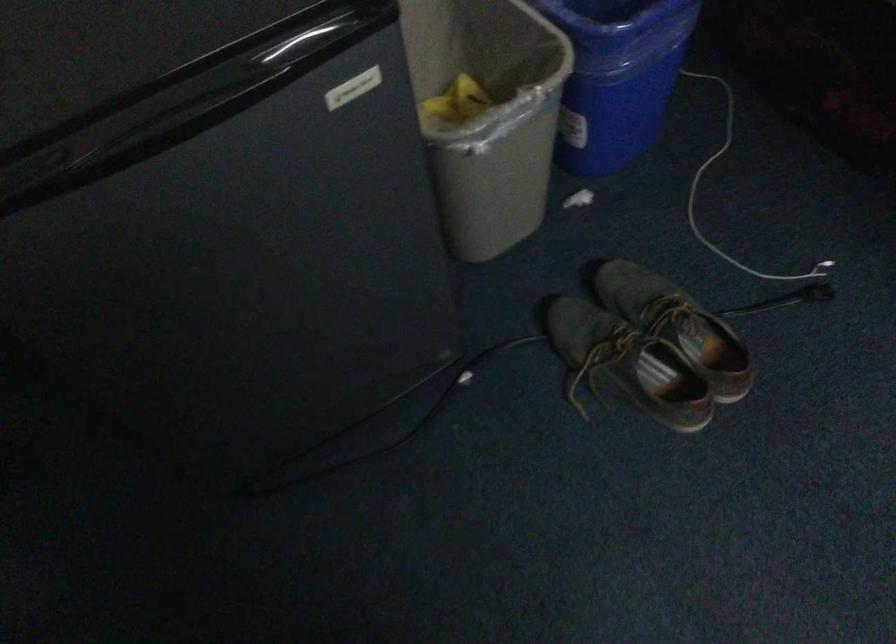
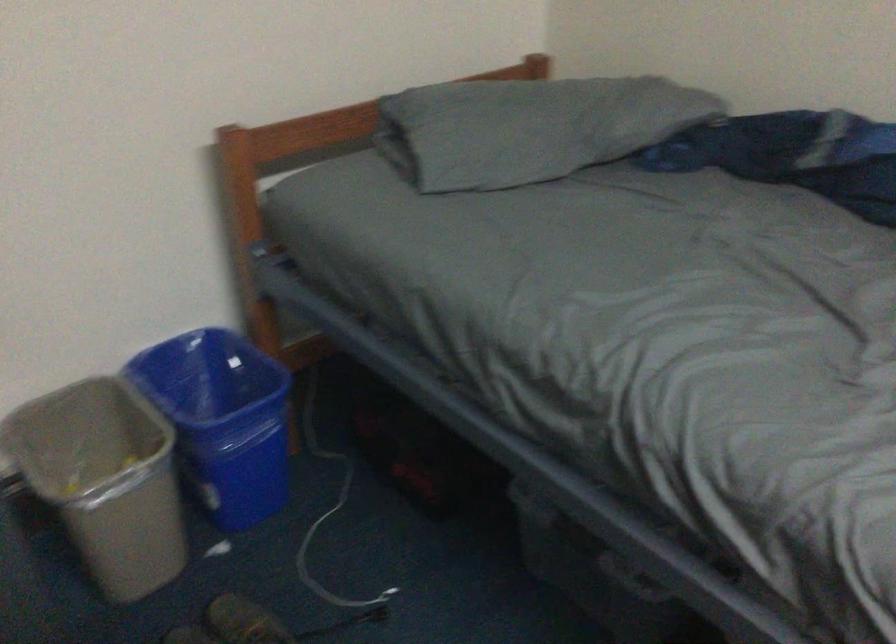
Question: I am providing you with two images of the same scene from different viewpoints. After the viewpoint changes to image2, which objects are now occluded?

Choices:
 (A) grey trash can
 (B) blue trash can
 (C) white electrical cable
 (D) none of these

Answer: (D)